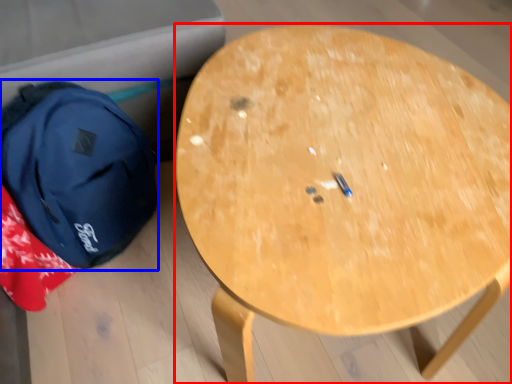
Question: Which object appears closest to the camera in this image, table (highlighted by a red box) or backpack (highlighted by a blue box)?

Choices:
 (A) table
 (B) backpack

Answer: (A)